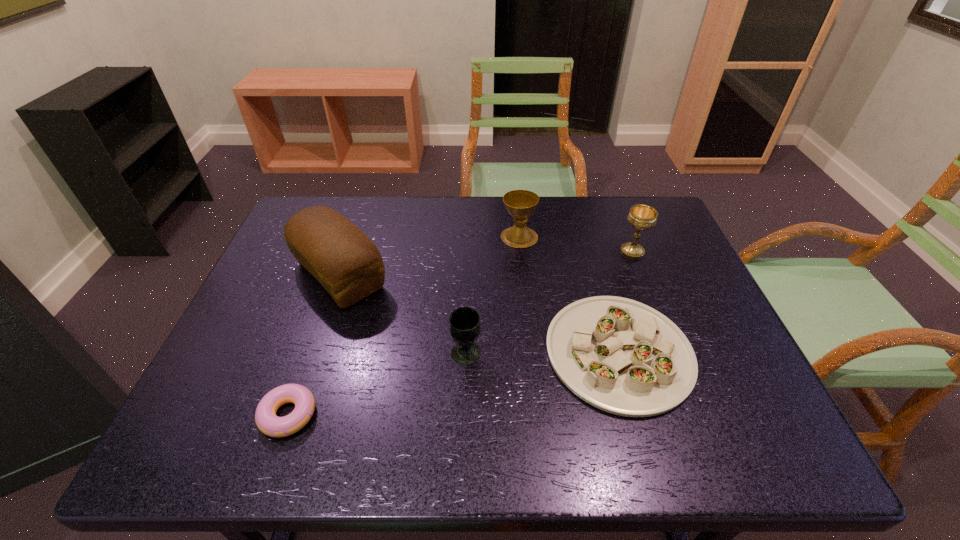
You are a GUI agent. You are given a task and a screenshot of the screen. Output one action in this format:
    pyautogui.click(x=<x>, y=<y>)
    Task: Click on the bread
    This screenshot has height=540, width=960.
    Given the screenshot: What is the action you would take?
    pyautogui.click(x=349, y=266)

Locate an element on the screen. The width and height of the screenshot is (960, 540). the rightmost chalice is located at coordinates (643, 217).

I want to click on the second chalice from right to left, so click(520, 204).

You are a GUI agent. You are given a task and a screenshot of the screen. Output one action in this format:
    pyautogui.click(x=<x>, y=<y>)
    Task: Click on the leftmost chalice
    The width and height of the screenshot is (960, 540).
    Given the screenshot: What is the action you would take?
    464,323

The height and width of the screenshot is (540, 960). Find the location of `the nearest chalice`. the nearest chalice is located at coordinates (464, 323).

Where is `platter`? This screenshot has height=540, width=960. platter is located at coordinates (621, 356).

You are a GUI agent. You are given a task and a screenshot of the screen. Output one action in this format:
    pyautogui.click(x=<x>, y=<y>)
    Task: Click on the doughnut
    The height and width of the screenshot is (540, 960).
    Given the screenshot: What is the action you would take?
    pyautogui.click(x=268, y=423)

Image resolution: width=960 pixels, height=540 pixels. What are the coordinates of `blank space located 0.130m on the front of the tallest object` in the screenshot? It's located at (312, 356).

Where is `free space located 0.110m on the back of the rightmost chalice`? free space located 0.110m on the back of the rightmost chalice is located at coordinates (620, 221).

Where is `free space located on the front of the second chalice from left to right`? free space located on the front of the second chalice from left to right is located at coordinates (525, 294).